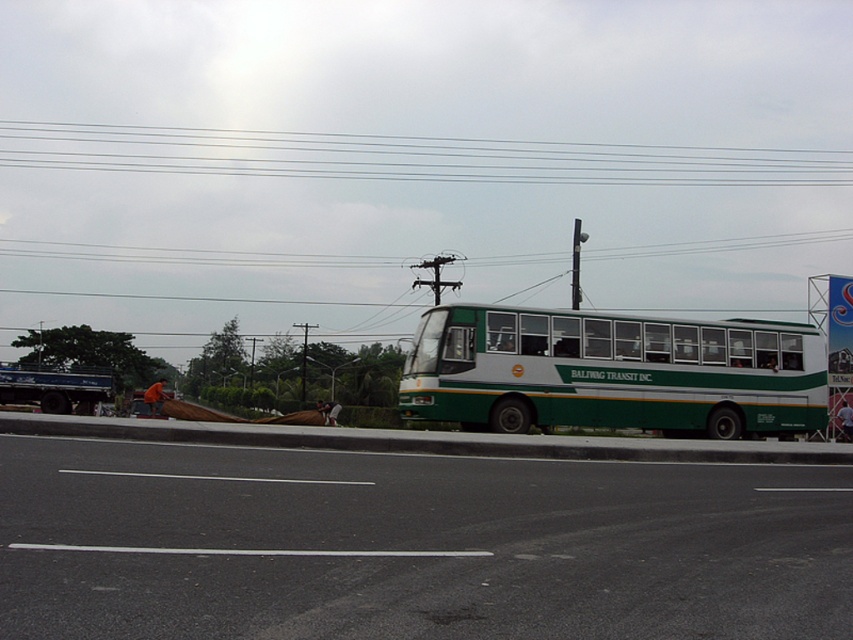
You are a delivery driver who needs to park your truck near the green matte bus at center without blocking the road. Based on the coordinates provided, where should you position your truck relative to the bus?

The green matte bus at center is located at coordinates point (613, 372). To park your truck without blocking the road, position it to the side of the bus, ensuring it does not encroach on the road area. Use the coordinates as a reference to align your parking spot appropriately.

You are a delivery driver who needs to park your truck at the green painted metal bus stop at center right. There are clear plastic power lines at upper center nearby. Will the power lines interfere with your truck if you park there?

The clear plastic power lines at upper center are positioned on the left side of the green painted metal bus stop at center right, so they are not directly above the bus stop. Therefore, parking there should not cause interference with the power lines.

You are a pedestrian standing on the sidewalk and want to check both the green matte bus at center and the green painted metal bus stop at center right. Which one do you see first as you walk towards them?

The green matte bus at center is closer to the viewer than the green painted metal bus stop at center right, so you will see the green matte bus at center first as you walk towards them.